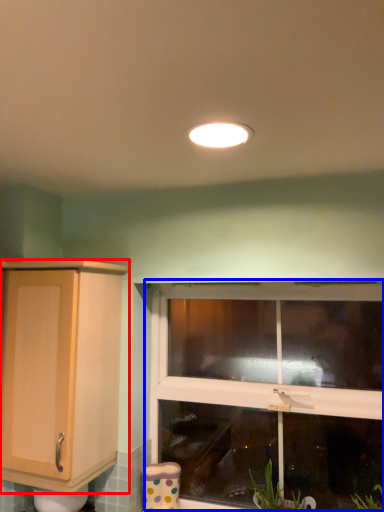
Question: Which of the following is the farthest to the observer, cabinetry (highlighted by a red box) or window (highlighted by a blue box)?

Choices:
 (A) cabinetry
 (B) window

Answer: (B)